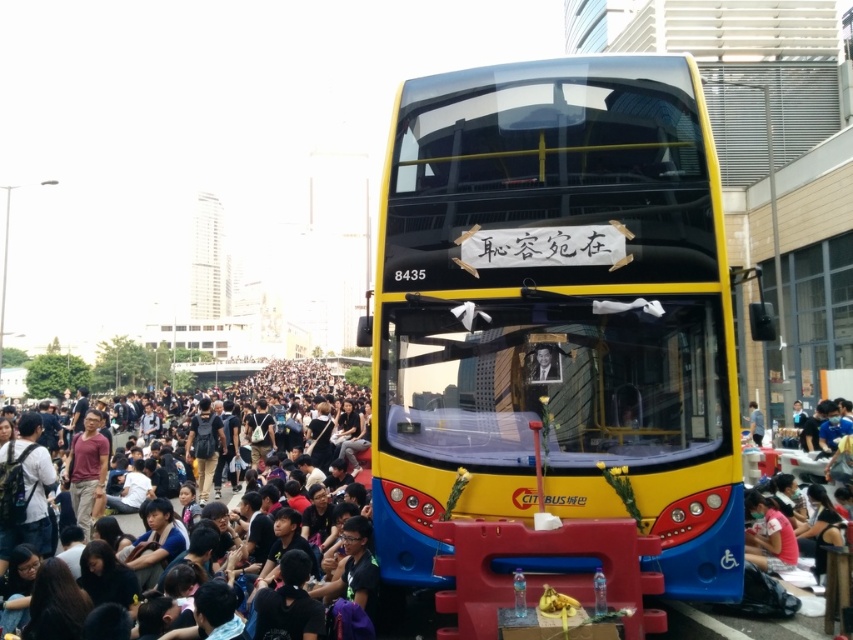
You are a pedestrian standing on the sidewalk and see the yellow matte bus at center. If you want to cross the street to reach the bus, and your walking speed is 1.5 meters per second, how many seconds will it take you to reach the bus?

The yellow matte bus at center is 9.57 meters away from the viewer. At a walking speed of 1.5 meters per second, it would take approximately 6.38 seconds to reach the bus.

You are a photographer standing at the edge of the scene. You want to capture a photo that includes both the yellow matte bus at center and the black fabric crowd at lower center. Based on their positions, which object should be placed on the left side of the photo to ensure both are included?

The black fabric crowd at lower center should be placed on the left side of the photo since the yellow matte bus at center is to the right of it, ensuring both are included in the frame.